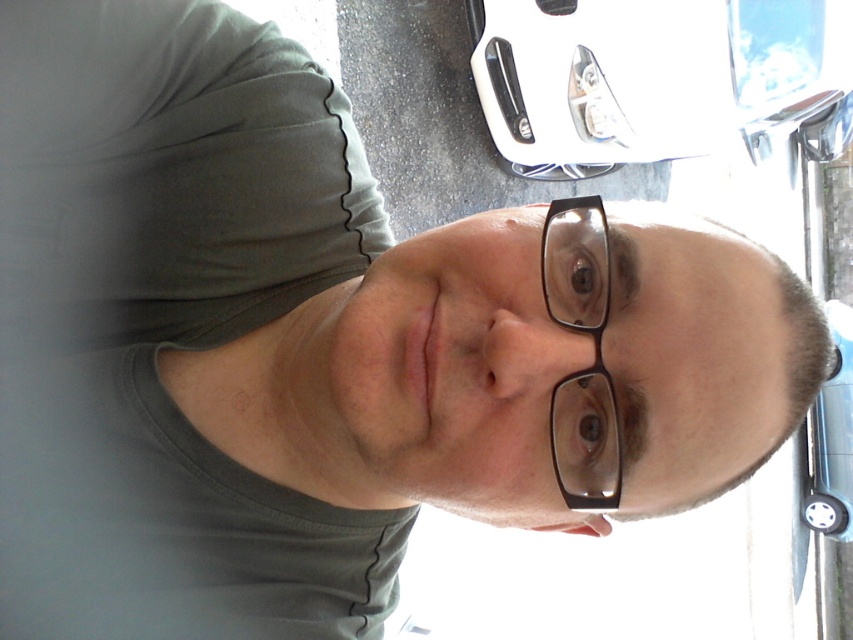
Is white glossy bumper at upper center further to camera compared to transparent plastic glasses at center?

Yes, it is behind transparent plastic glasses at center.

Who is positioned more to the left, white glossy bumper at upper center or transparent plastic glasses at center?

transparent plastic glasses at center

Is point (538, 4) farther from camera compared to point (556, 307)?

That is True.

Image resolution: width=853 pixels, height=640 pixels. I want to click on white glossy bumper at upper center, so click(x=648, y=76).